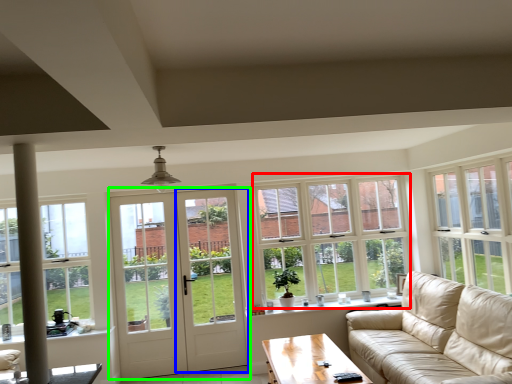
Question: Which is nearer to the window (highlighted by a red box)? screen door (highlighted by a blue box) or door (highlighted by a green box).

Choices:
 (A) screen door
 (B) door

Answer: (A)